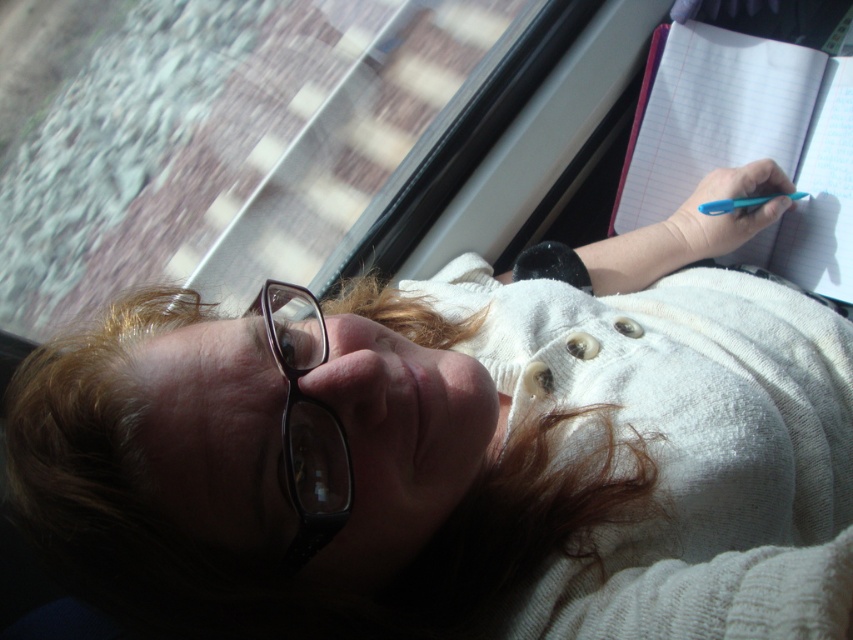
Which is below, matte white sweater at center or black plastic glasses at lower left?

matte white sweater at center is below.

Can you confirm if matte white sweater at center is positioned above black plastic glasses at lower left?

Actually, matte white sweater at center is below black plastic glasses at lower left.

This screenshot has height=640, width=853. Describe the element at coordinates (463, 451) in the screenshot. I see `matte white sweater at center` at that location.

Find the location of a particular element. matte white sweater at center is located at coordinates (463, 451).

Who is more distant from viewer, (653, 99) or (283, 412)?

The point (653, 99) is more distant.

Is pink paper notebook at upper right wider than black plastic glasses at lower left?

Yes.

Who is more forward, (766, 237) or (297, 436)?

Point (297, 436) is in front.

Where is `pink paper notebook at upper right`? The height and width of the screenshot is (640, 853). pink paper notebook at upper right is located at coordinates (747, 141).

Can you confirm if matte white sweater at center is positioned to the left of pink paper notebook at upper right?

Yes, matte white sweater at center is to the left of pink paper notebook at upper right.

This screenshot has width=853, height=640. Identify the location of matte white sweater at center. (463, 451).